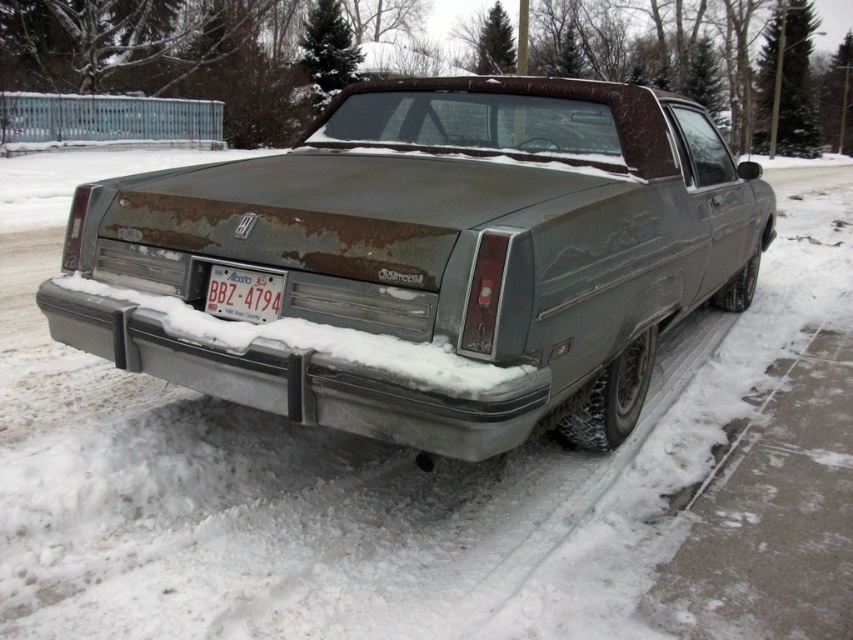
Looking at this image, you are a delivery person trying to determine if the rusty metal car at center is taller than the white plastic license plate at center. Based on the scene, can you confirm which object is taller?

The rusty metal car at center has a greater height compared to the white plastic license plate at center, so the rusty metal car at center is taller.